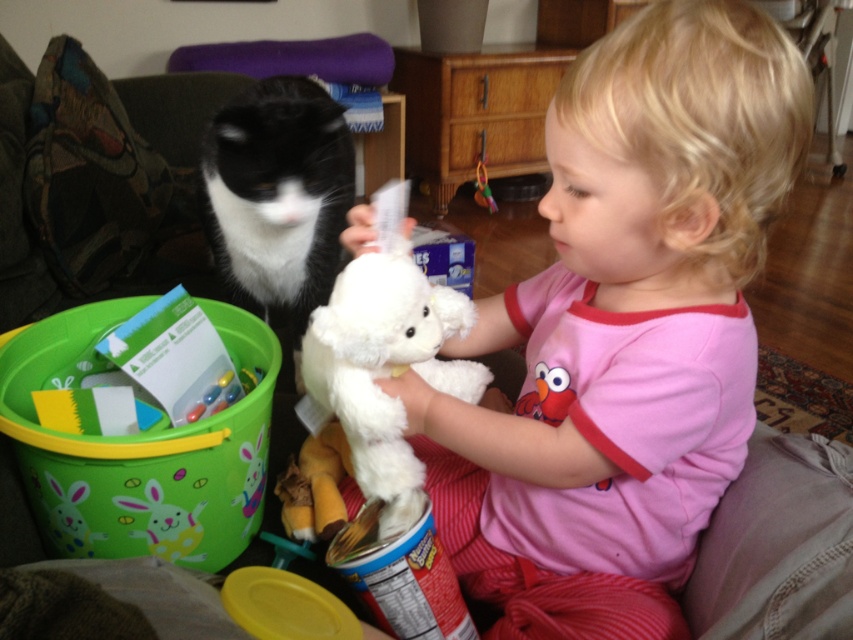
Question: Does black and white fur cat at left have a smaller size compared to white plush at center?

Choices:
 (A) no
 (B) yes

Answer: (A)

Question: Is white plush toy at center above black and white fur cat at left?

Choices:
 (A) no
 (B) yes

Answer: (A)

Question: Does black and white fur cat at left have a larger size compared to white plush at center?

Choices:
 (A) no
 (B) yes

Answer: (B)

Question: Which of the following is the closest to the observer?

Choices:
 (A) (312, 412)
 (B) (683, 339)
 (C) (254, 154)

Answer: (B)

Question: Which object is farther from the camera taking this photo?

Choices:
 (A) white plush toy at center
 (B) white plush at center
 (C) black and white fur cat at left

Answer: (C)

Question: Based on their relative distances, which object is nearer to the white plush at center?

Choices:
 (A) white plush toy at center
 (B) black and white fur cat at left

Answer: (A)